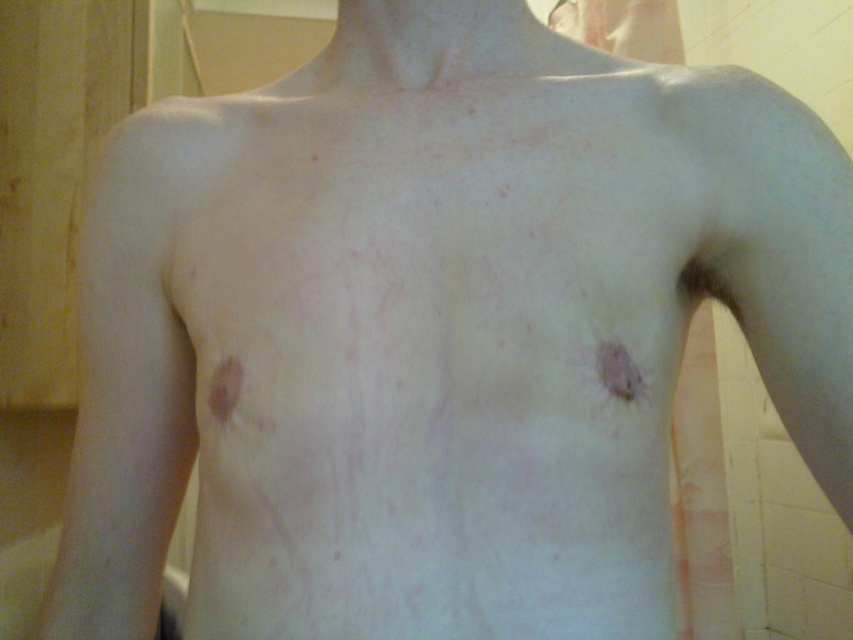
You are a medical professional examining a patient. The patient has a pink matte scar at center on their chest. Based on the coordinates provided, where exactly is the pink matte scar located on the patient?

The pink matte scar at center is located at coordinates point (618, 371).

Based on the photo, you are a medical professional examining a patient. You notice two points on their chest marked as point 1 at coordinates (616, 380) and point 2 at (223, 362). Based on the image, which point is closer to the observer?

Point 1 at coordinates (616, 380) is closer to the observer because it is in front of point 2 at (223, 362).